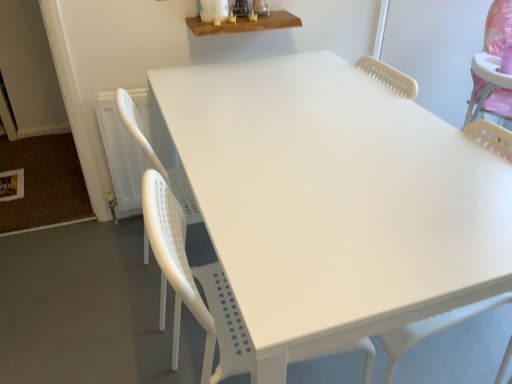
Where is `free space above wooden shelf at upper center, positioned as the first table in top-to-bottom order (from a real-world perspective)`? free space above wooden shelf at upper center, positioned as the first table in top-to-bottom order (from a real-world perspective) is located at coordinates (250, 17).